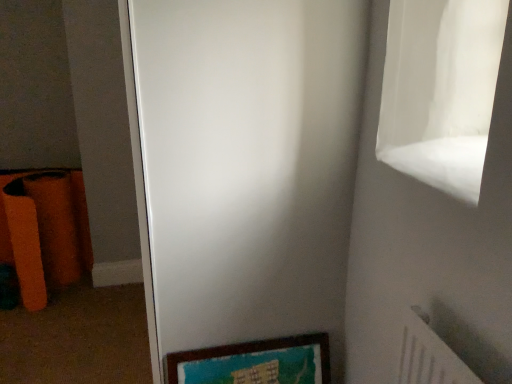
Question: Is white matte screen door at center taller or shorter than wooden picture frame at lower center?

Choices:
 (A) tall
 (B) short

Answer: (A)

Question: Is white matte screen door at center inside or outside of wooden picture frame at lower center?

Choices:
 (A) outside
 (B) inside

Answer: (A)

Question: Considering their positions, is white matte screen door at center located in front of or behind wooden picture frame at lower center?

Choices:
 (A) behind
 (B) front

Answer: (B)

Question: Considering the positions of wooden picture frame at lower center and white matte screen door at center in the image, is wooden picture frame at lower center taller or shorter than white matte screen door at center?

Choices:
 (A) tall
 (B) short

Answer: (B)

Question: From a real-world perspective, is wooden picture frame at lower center above or below white matte screen door at center?

Choices:
 (A) below
 (B) above

Answer: (A)

Question: Considering the positions of wooden picture frame at lower center and white matte screen door at center in the image, is wooden picture frame at lower center wider or thinner than white matte screen door at center?

Choices:
 (A) thin
 (B) wide

Answer: (A)

Question: Do you think wooden picture frame at lower center is within white matte screen door at center, or outside of it?

Choices:
 (A) outside
 (B) inside

Answer: (B)